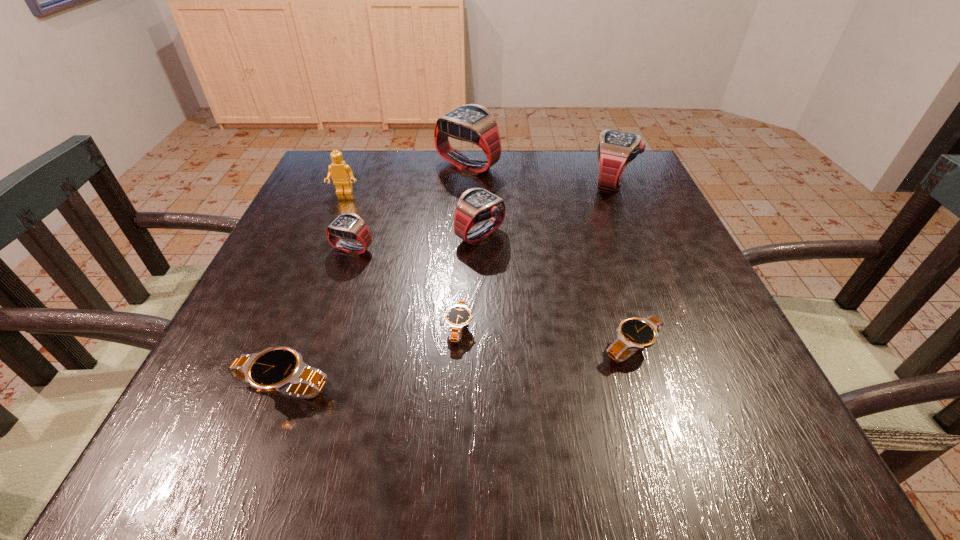
Find the location of a particular element. free spot located on the left of the rightmost black watch is located at coordinates (529, 348).

Image resolution: width=960 pixels, height=540 pixels. Find the location of `free location located 0.070m on the left of the shortest object`. free location located 0.070m on the left of the shortest object is located at coordinates (406, 328).

You are a GUI agent. You are given a task and a screenshot of the screen. Output one action in this format:
    pyautogui.click(x=<x>, y=<y>)
    Task: Click on the Lego that is positioned at the far edge
    The image size is (960, 540).
    Given the screenshot: What is the action you would take?
    pyautogui.click(x=342, y=175)

You are a GUI agent. You are given a task and a screenshot of the screen. Output one action in this format:
    pyautogui.click(x=<x>, y=<y>)
    Task: Click on the Lego located at the left edge
    
    Given the screenshot: What is the action you would take?
    pyautogui.click(x=342, y=175)

Image resolution: width=960 pixels, height=540 pixels. Find the location of `object that is at the far left corner`. object that is at the far left corner is located at coordinates coord(342,175).

In order to click on object situated at the far right corner in this screenshot , I will do `click(616, 150)`.

You are a GUI agent. You are given a task and a screenshot of the screen. Output one action in this format:
    pyautogui.click(x=<x>, y=<y>)
    Task: Click on the vacant space at the far edge
    
    Given the screenshot: What is the action you would take?
    pyautogui.click(x=520, y=183)

I want to click on free region at the near edge, so click(432, 458).

Locate an element on the screen. Image resolution: width=960 pixels, height=540 pixels. vacant space at the left edge of the desktop is located at coordinates (338, 259).

Identify the location of vacant region at the right edge of the desktop. (628, 239).